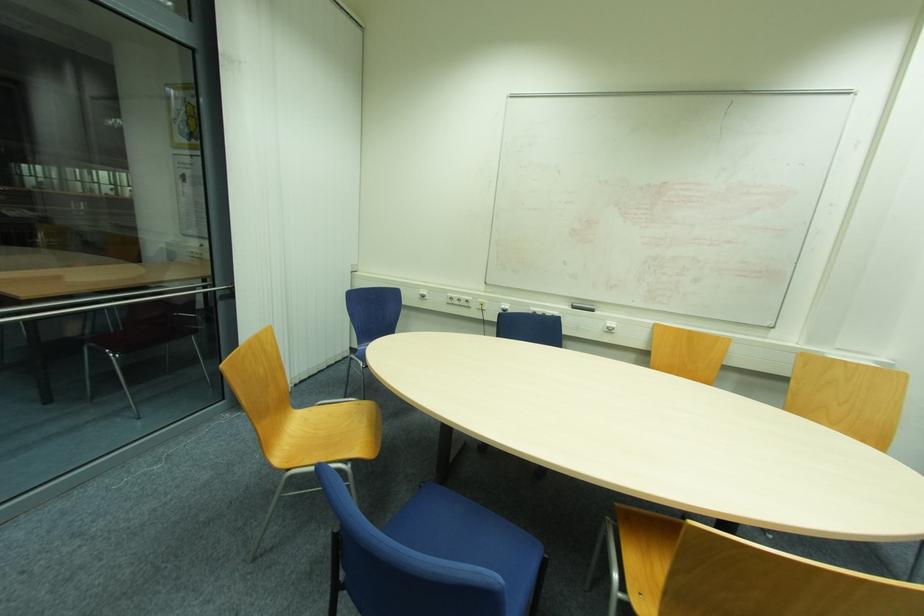
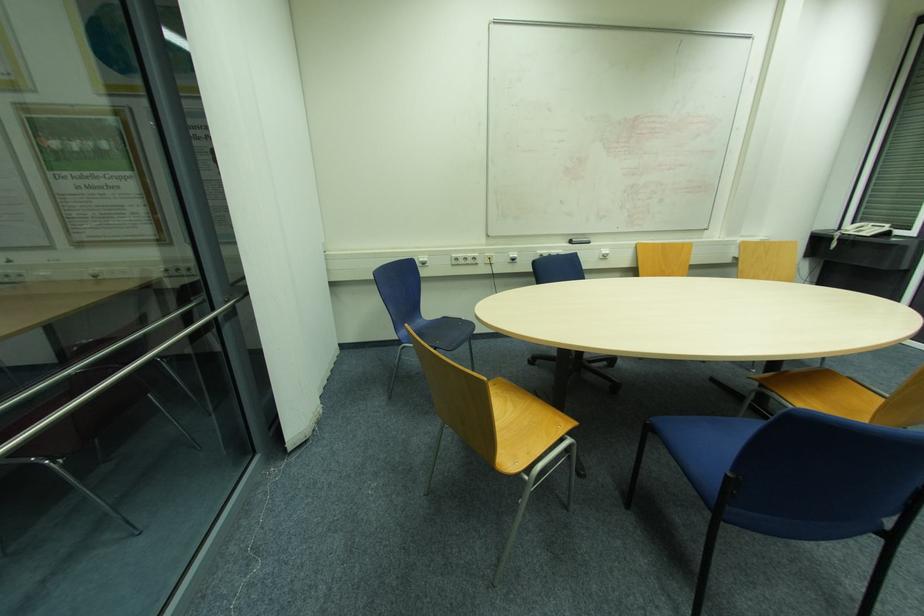
In the second image, find the point that corresponds to point 575,309 in the first image.

(574, 244)